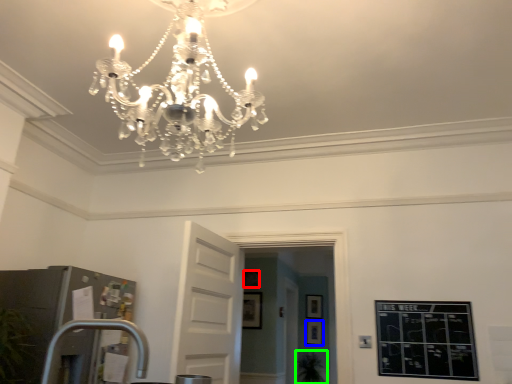
Question: Considering the real-world distances, which object is farthest from picture frame (highlighted by a red box)? picture frame (highlighted by a blue box) or plant (highlighted by a green box)?

Choices:
 (A) picture frame
 (B) plant

Answer: (B)